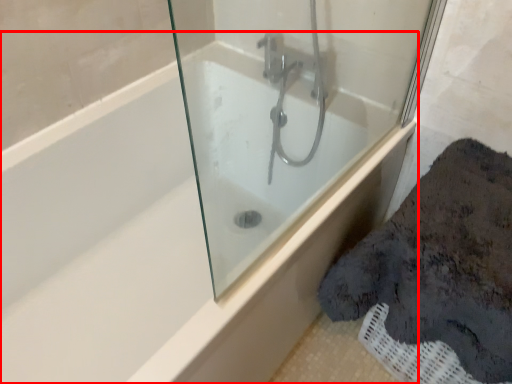
Question: Observing the image, what is the correct spatial positioning of bathtub (annotated by the red box) in reference to bath?

Choices:
 (A) right
 (B) left

Answer: (B)